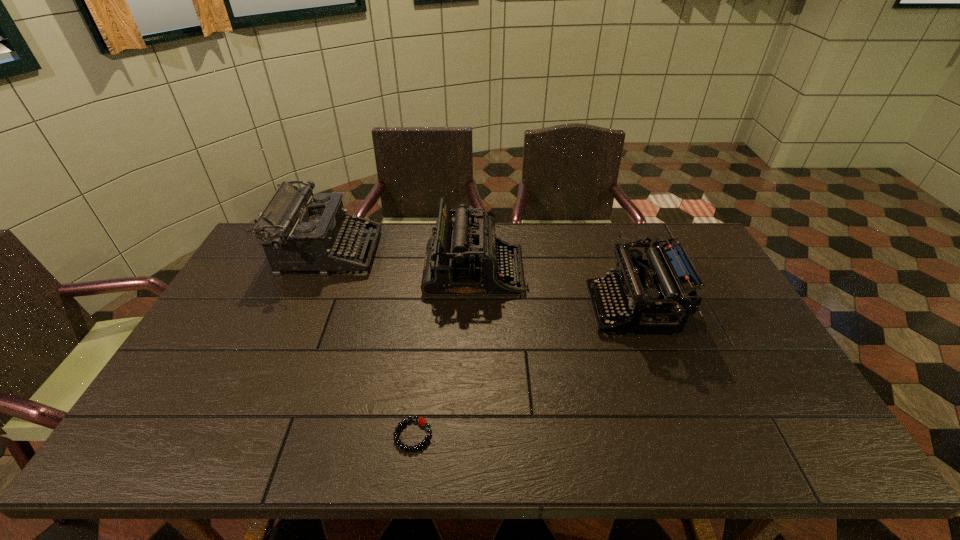
Identify which typewriter is located as the nearest to the bracelet. Please provide its 2D coordinates. Your answer should be formatted as a tuple, i.e. [(x, y)], where the tuple contains the x and y coordinates of a point satisfying the conditions above.

[(465, 258)]

Where is `blank space that satisfies the following two spatial constraints: 1. on the typing side of the nearest object; 2. on the left side of the leftmost typewriter`? The image size is (960, 540). blank space that satisfies the following two spatial constraints: 1. on the typing side of the nearest object; 2. on the left side of the leftmost typewriter is located at coordinates (251, 435).

Identify the location of vacant space that satisfies the following two spatial constraints: 1. on the keyboard of the second typewriter from right to left; 2. on the front side of the shortest object. (473, 435).

You are a GUI agent. You are given a task and a screenshot of the screen. Output one action in this format:
    pyautogui.click(x=<x>, y=<y>)
    Task: Click on the free space that satisfies the following two spatial constraints: 1. on the keyboard of the second typewriter from left to right; 2. on the front side of the bracelet
    
    Given the screenshot: What is the action you would take?
    pyautogui.click(x=473, y=435)

Locate an element on the screen. This screenshot has width=960, height=540. free location that satisfies the following two spatial constraints: 1. on the keyboard of the rightmost typewriter; 2. on the front side of the nearest object is located at coordinates (678, 435).